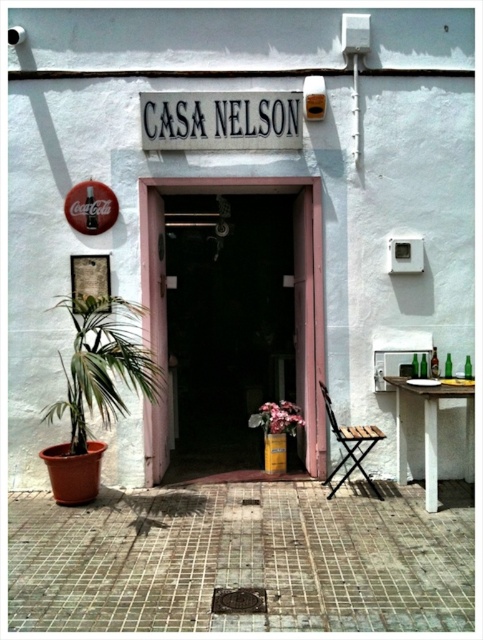
You are a visitor at CASA NELSON and need to sit down. There is a wooden folding chair at lower right and a pink matte flower at center. Which object is taller and can you sit on it?

The wooden folding chair at lower right is taller than the pink matte flower at center. You can sit on the wooden folding chair at lower right since it is a chair designed for sitting.

You are standing at the entrance of CASA NELSON and want to sit down. There is a wooden folding chair at lower right. Can you reach it without moving more than 3 meters forward?

The wooden folding chair at lower right is 3.28 meters from the viewer, so you would need to move more than 3 meters forward to reach it.